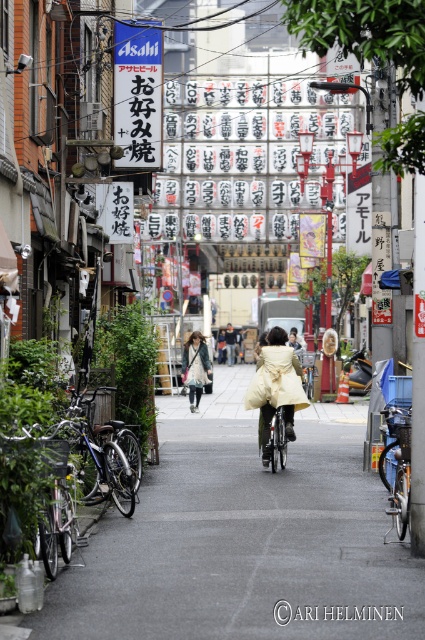
Is light yellow fabric coat at center below shiny metallic bicycle at center?

No.

Is point (286, 376) behind point (280, 406)?

Yes, point (286, 376) is farther from viewer.

Locate an element on the screen. The width and height of the screenshot is (425, 640). light yellow fabric coat at center is located at coordinates (275, 387).

Does smooth asphalt road at center have a larger size compared to matte beige coat at center?

Actually, smooth asphalt road at center might be smaller than matte beige coat at center.

The width and height of the screenshot is (425, 640). I want to click on smooth asphalt road at center, so click(240, 536).

What do you see at coordinates (240, 536) in the screenshot? I see `smooth asphalt road at center` at bounding box center [240, 536].

Locate an element on the screen. This screenshot has height=640, width=425. smooth asphalt road at center is located at coordinates (240, 536).

Which is more to the right, light yellow fabric coat at center or matte beige coat at center?

light yellow fabric coat at center

Does light yellow fabric coat at center have a larger size compared to matte beige coat at center?

No, light yellow fabric coat at center is not bigger than matte beige coat at center.

What do you see at coordinates (275, 387) in the screenshot? I see `light yellow fabric coat at center` at bounding box center [275, 387].

What are the coordinates of `light yellow fabric coat at center` in the screenshot? It's located at (275, 387).